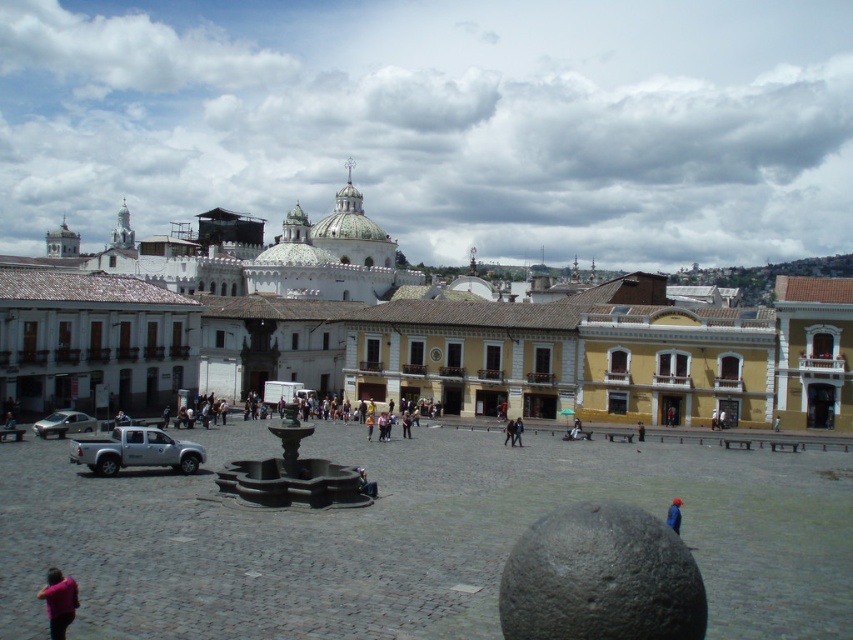
Can you confirm if smooth concrete fountain at center is thinner than dark blue jeans at center?

No, smooth concrete fountain at center is not thinner than dark blue jeans at center.

Who is positioned more to the left, smooth concrete fountain at center or dark blue jeans at center?

Positioned to the left is smooth concrete fountain at center.

Who is more distant from viewer, (801, 484) or (637, 420)?

The point (637, 420) is behind.

Where is `smooth concrete fountain at center`? smooth concrete fountain at center is located at coordinates click(x=409, y=536).

How far apart are smooth concrete fountain at center and silver metallic car at lower left?

The distance of smooth concrete fountain at center from silver metallic car at lower left is 22.41 meters.

Who is taller, smooth concrete fountain at center or silver metallic car at lower left?

smooth concrete fountain at center is taller.

Find the location of `smooth concrete fountain at center`. smooth concrete fountain at center is located at coordinates (409, 536).

You are a GUI agent. You are given a task and a screenshot of the screen. Output one action in this format:
    pyautogui.click(x=<x>, y=<y>)
    Task: Click on the smooth concrete fountain at center
    
    Given the screenshot: What is the action you would take?
    pyautogui.click(x=409, y=536)

In the scene shown: Does smooth concrete fountain at center appear on the left side of blue fabric person at lower right?

Correct, you'll find smooth concrete fountain at center to the left of blue fabric person at lower right.

Which is in front, point (405, 538) or point (672, 516)?

Point (672, 516) is more forward.

Measure the distance between smooth concrete fountain at center and camera.

They are 31.60 meters apart.

At what (x,y) coordinates should I click in order to perform the action: click on smooth concrete fountain at center. Please return your answer as a coordinate pair (x, y). Looking at the image, I should click on (409, 536).